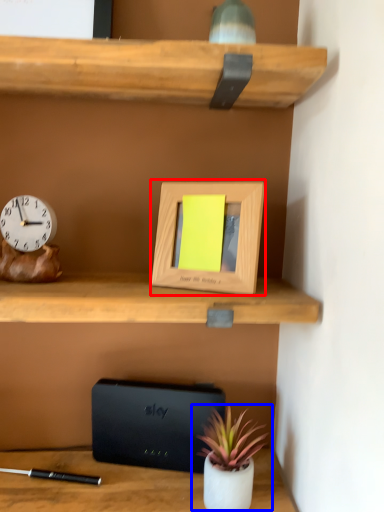
Question: Which point is closer to the camera, picture frame (highlighted by a red box) or houseplant (highlighted by a blue box)?

Choices:
 (A) picture frame
 (B) houseplant

Answer: (A)